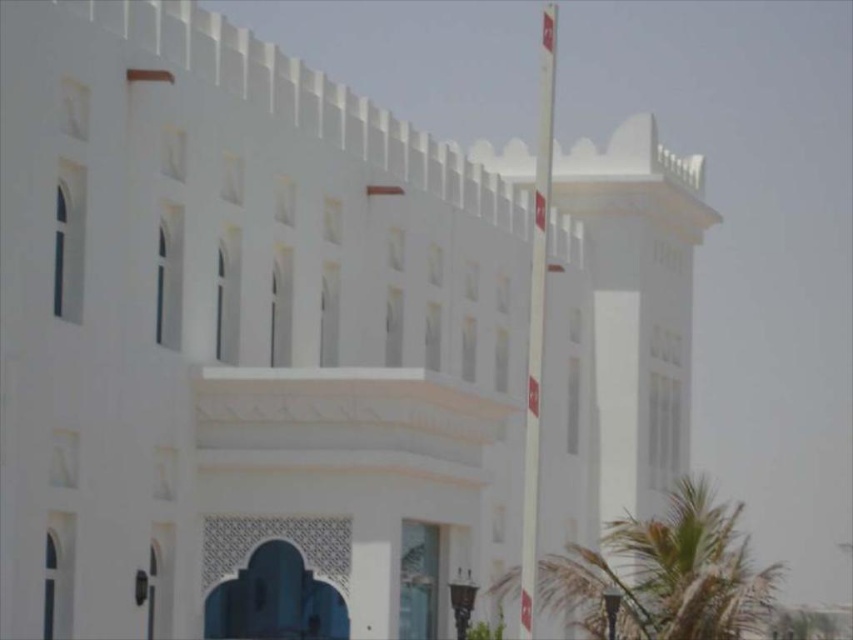
Consider the image. You are standing in front of the building and want to take a photo of the white plastic flag pole at right. However, there is a green leafy palm tree at lower right blocking your view. Can you move to the left to get a clear shot of the flag pole without the tree in the frame?

The green leafy palm tree at lower right is shorter than the white plastic flag pole at right. Since the palm tree is shorter, moving to the left might still allow you to see the taller flag pole above the tree, but the tree might still partially block the view depending on the angle. However, since the palm tree is at lower right and the flag pole is at right, moving left could position the tree out of the frame if the distance is sufficient.

You are standing in front of the building and want to determine the relative positions of two points marked on the facade. Which point is closer to you, point (x=734, y=525) or point (x=543, y=180)?

Point (x=734, y=525) is further to the viewer than point (x=543, y=180), so point (x=543, y=180) is closer to you.